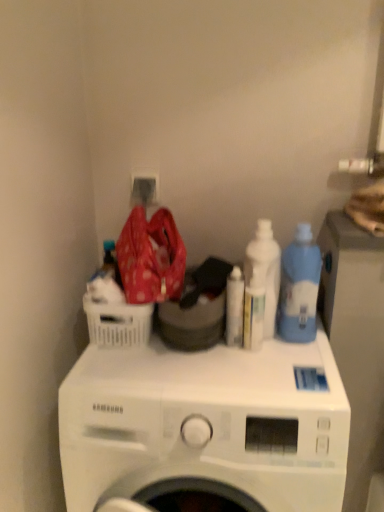
Find the location of a particular element. This screenshot has height=512, width=384. free space on the front side of blue translucent bottle at right, placed as the third cleaning product when sorted from left to right is located at coordinates (294, 367).